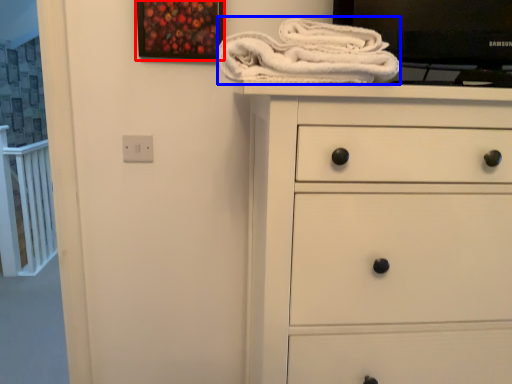
Question: Which point is closer to the camera, picture frame (highlighted by a red box) or bath towel (highlighted by a blue box)?

Choices:
 (A) picture frame
 (B) bath towel

Answer: (B)